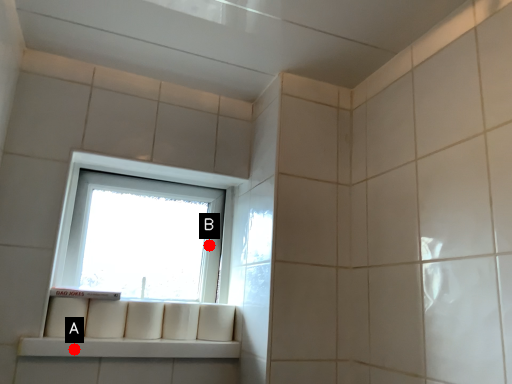
Question: Two points are circled on the image, labeled by A and B beside each circle. Among these points, which one is nearest to the camera?

Choices:
 (A) A is closer
 (B) B is closer

Answer: (A)